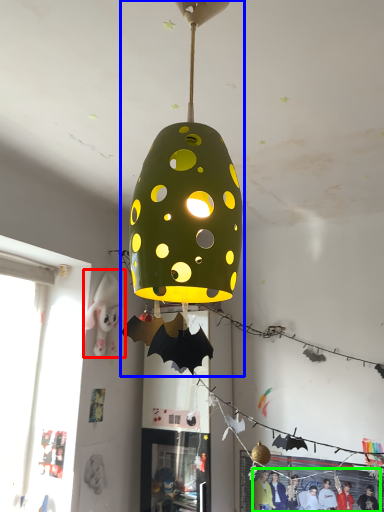
Question: Estimate the real-world distances between objects in this image. Which object is closer to person (highlighted by a red box), lamp (highlighted by a blue box) or person (highlighted by a green box)?

Choices:
 (A) lamp
 (B) person

Answer: (B)